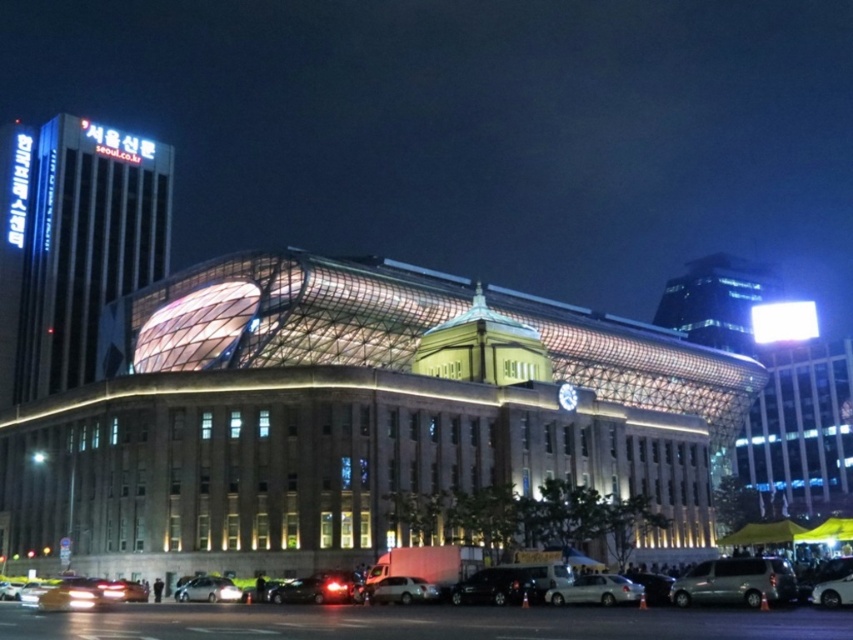
You are standing at the entrance of the building and want to locate the brick building at center. What are the coordinates where you should look?

The brick building at center is located at coordinates point (350,417).

You are standing in front of the brick building at center and want to take a photo of the silver metallic van at lower right. Which direction should you move to get the van in your frame?

You should move downward because the brick building at center is located above the silver metallic van at lower right, so moving downward will bring the van into view.